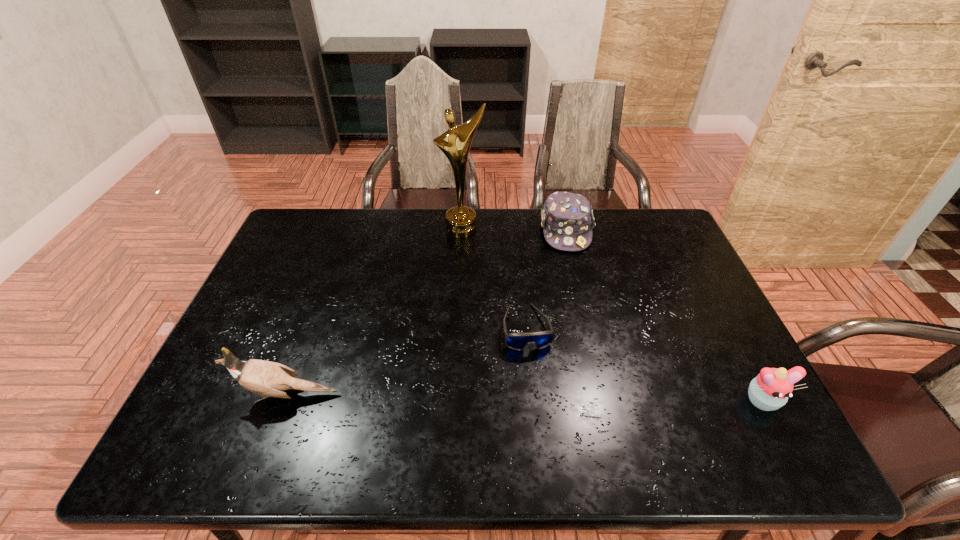
Image resolution: width=960 pixels, height=540 pixels. Find the location of `free space between the sunglasses and the cupcake`. free space between the sunglasses and the cupcake is located at coordinates (644, 364).

Locate an element on the screen. The height and width of the screenshot is (540, 960). empty space that is in between the award and the third object from right to left is located at coordinates click(494, 279).

You are a GUI agent. You are given a task and a screenshot of the screen. Output one action in this format:
    pyautogui.click(x=<x>, y=<y>)
    Task: Click on the vacant area that lies between the cupcake and the shortest object
    The width and height of the screenshot is (960, 540).
    Given the screenshot: What is the action you would take?
    tap(644, 364)

Identify the location of vacant area between the shortest object and the headwear. The height and width of the screenshot is (540, 960). (546, 279).

Identify the location of vacant space that is in between the tallest object and the leftmost object. 375,312.

Image resolution: width=960 pixels, height=540 pixels. What are the coordinates of `free point between the rightmost object and the headwear` in the screenshot? It's located at click(x=663, y=315).

Locate an element on the screen. This screenshot has height=540, width=960. free area in between the sunglasses and the tallest object is located at coordinates (494, 279).

Locate an element on the screen. The width and height of the screenshot is (960, 540). vacant area that lies between the rightmost object and the tallest object is located at coordinates (612, 315).

Find the location of a particular element. Image resolution: width=960 pixels, height=540 pixels. empty space that is in between the third object from right to left and the cupcake is located at coordinates (644, 364).

This screenshot has width=960, height=540. I want to click on vacant area that lies between the rightmost object and the bird, so tap(525, 397).